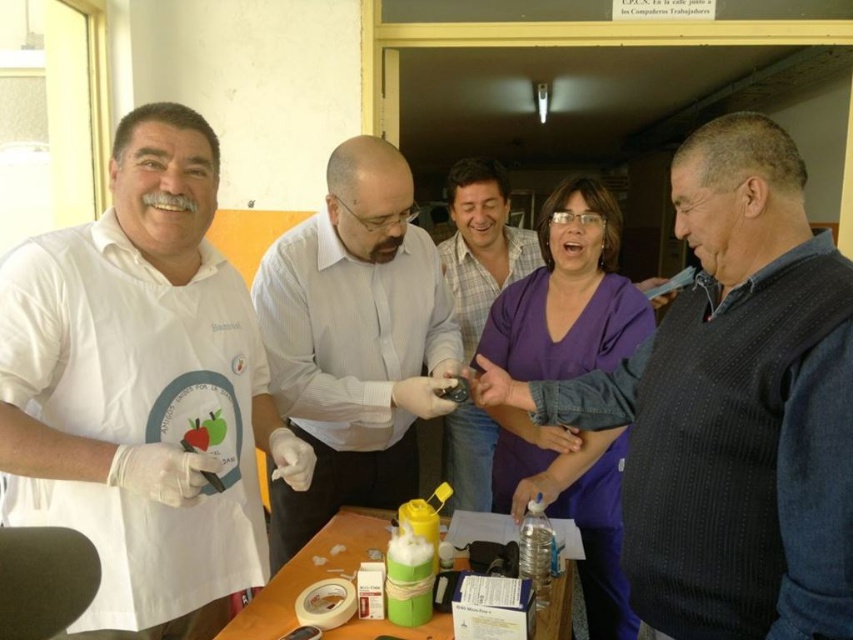
What do you see at coordinates (143, 390) in the screenshot? The height and width of the screenshot is (640, 853). I see `white matte shirt at left` at bounding box center [143, 390].

Which is more to the left, white matte shirt at left or dark blue sweater at center?

white matte shirt at left

Between point (221, 280) and point (830, 285), which one is positioned behind?

Positioned behind is point (221, 280).

What are the coordinates of `white matte shirt at left` in the screenshot? It's located at (143, 390).

Can you confirm if dark blue sweater at center is taller than green plastic bottle at center?

Indeed, dark blue sweater at center has a greater height compared to green plastic bottle at center.

Is dark blue sweater at center thinner than green plastic bottle at center?

Correct, dark blue sweater at center's width is less than green plastic bottle at center's.

Locate an element on the screen. The image size is (853, 640). dark blue sweater at center is located at coordinates (730, 406).

Which is more to the left, white glossy shirt at center or green plastic bottle at center?

white glossy shirt at center

Who is more forward, (350, 323) or (257, 604)?

Point (257, 604)

I want to click on white glossy shirt at center, so click(354, 340).